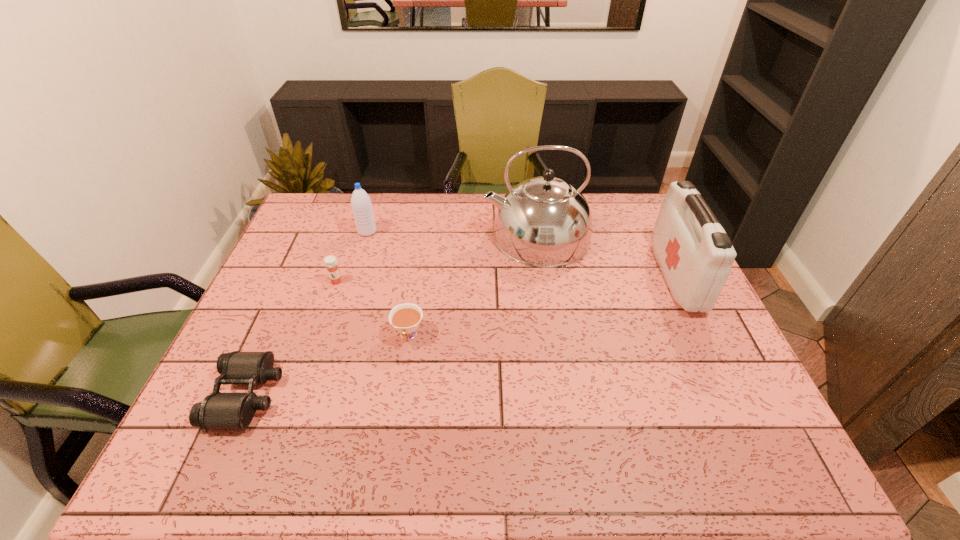
Locate an element on the screen. Image resolution: width=960 pixels, height=540 pixels. kettle is located at coordinates (544, 221).

Identify the location of the tallest object. (544, 221).

In order to click on the second tallest object in this screenshot , I will do (695, 255).

At what (x,y) coordinates should I click in order to perform the action: click on the rightmost object. Please return your answer as a coordinate pair (x, y). This screenshot has height=540, width=960. Looking at the image, I should click on (695, 255).

This screenshot has width=960, height=540. Identify the location of the fourth shortest object. (361, 204).

In order to click on medicine in this screenshot , I will do `click(330, 262)`.

Where is `the second nearest object`? Image resolution: width=960 pixels, height=540 pixels. the second nearest object is located at coordinates (405, 318).

Where is `teacup`? teacup is located at coordinates (405, 318).

Where is `binoculars`? This screenshot has width=960, height=540. binoculars is located at coordinates (218, 410).

This screenshot has height=540, width=960. Find the location of `the leftmost object`. the leftmost object is located at coordinates (218, 410).